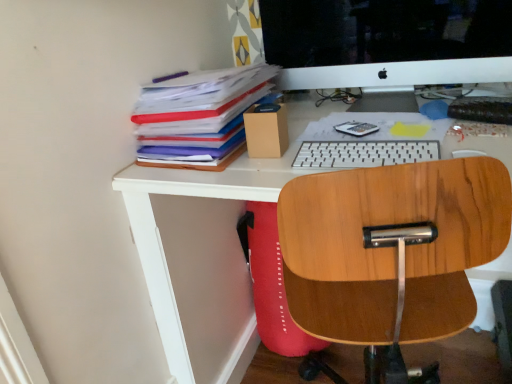
Question: Looking at the image, does white plastic keyboard at center seem bigger or smaller compared to white glossy computer monitor at upper center?

Choices:
 (A) small
 (B) big

Answer: (A)

Question: From the image's perspective, is white plastic keyboard at center positioned above or below white glossy computer monitor at upper center?

Choices:
 (A) above
 (B) below

Answer: (B)

Question: Which object is positioned farthest from the white glossy computer monitor at upper center?

Choices:
 (A) wooden office chair at center
 (B) multicolored paper at upper left
 (C) white plastic keyboard at center

Answer: (A)

Question: Which of these objects is positioned closest to the white glossy computer monitor at upper center?

Choices:
 (A) wooden office chair at center
 (B) multicolored paper at upper left
 (C) white plastic keyboard at center

Answer: (B)